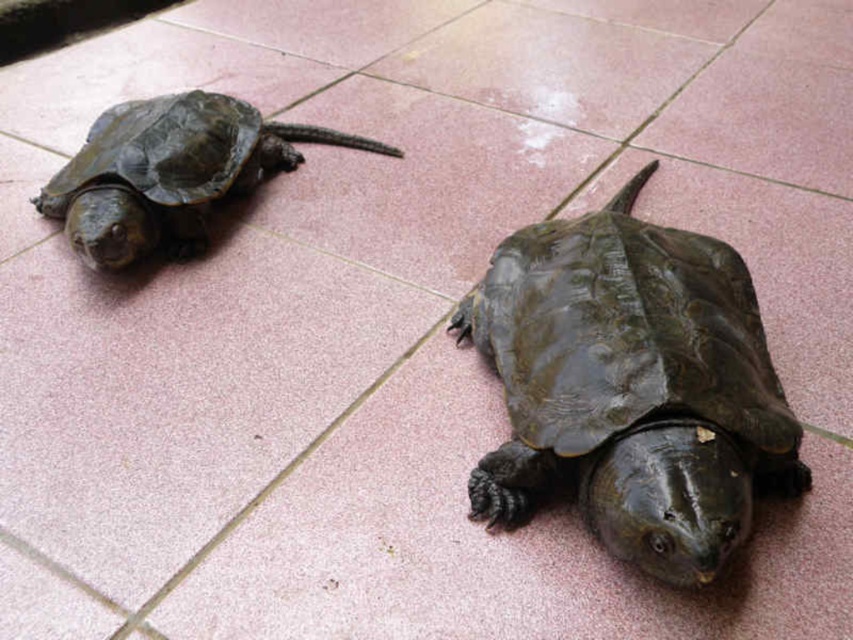
You are a pet owner who wants to ensure the two shiny dark green tortoises are spaced appropriately for their comfort. Given that the recommended minimum distance between two tortoises is 30 inches, can the shiny dark green tortoise at center and the shiny dark green tortoise at left be placed closer together without violating the recommendation?

The distance between the shiny dark green tortoise at center and the shiny dark green tortoise at left is 33.54 inches, which exceeds the recommended minimum of 30 inches. Therefore, they can be moved closer together while still maintaining the required distance.

You are a photographer trying to capture both shiny dark green tortoise at center and shiny dark green tortoise at left in a single shot. Since the camera can only focus on objects within a 10 cm width range, will both tortoises fit within this range?

The shiny dark green tortoise at center is thinner than the shiny dark green tortoise at left. However, the camera requires both to be within a 10 cm width range. Since the width difference isn

You are standing at the point marked by the coordinates point [631,385]. Looking around, you see a shiny dark green tortoise at center. Which direction should you move to reach the smaller turtle on the left?

The point [631,385] indicates the shiny dark green tortoise at center. To reach the smaller turtle on the left, you should move towards the top left direction since the smaller turtle is positioned closer to the top left corner of the frame.